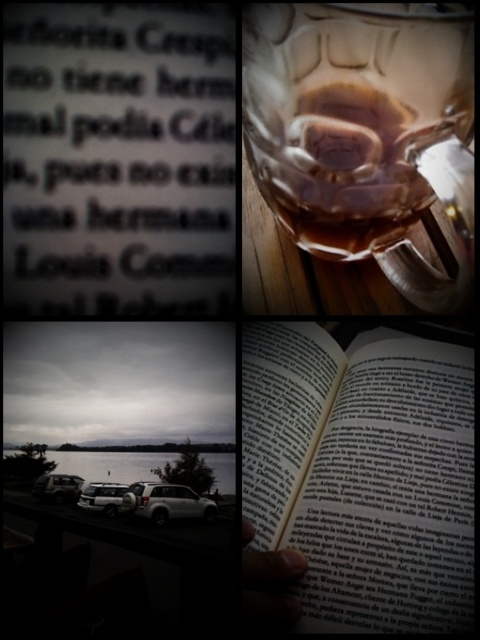
Question: Does white paper book at center come behind white matte car at lower left?

Choices:
 (A) no
 (B) yes

Answer: (A)

Question: Which point appears closest to the camera in this image?

Choices:
 (A) (208, 230)
 (B) (120, 483)

Answer: (A)

Question: Which of the following is the farthest from the observer?

Choices:
 (A) (456, 356)
 (B) (63, 493)
 (C) (171, 193)
 (D) (326, 125)

Answer: (A)

Question: Does black paper book at upper left appear over clear textured glass at upper right?

Choices:
 (A) no
 (B) yes

Answer: (B)

Question: Is white matte car at lower left further to camera compared to silver metallic car at lower left?

Choices:
 (A) no
 (B) yes

Answer: (A)

Question: Which point is farther to the camera?

Choices:
 (A) (111, 483)
 (B) (224, 188)
 (C) (462, 92)

Answer: (A)